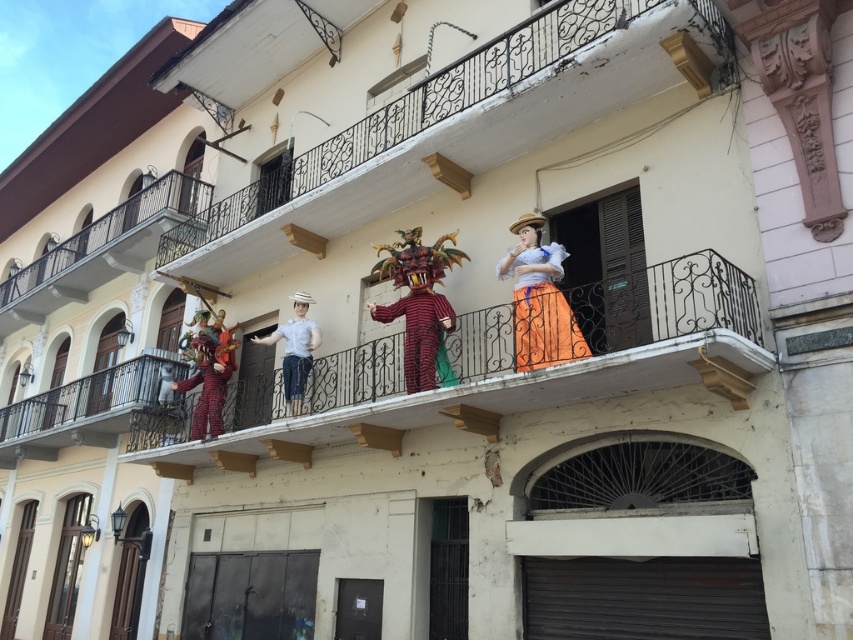
You are standing on the ground floor of the two story building and looking up at the white wrought iron balcony at upper left and the orange satin dress at center. Which object is higher up?

The white wrought iron balcony at upper left is located above the orange satin dress at center, so it is higher up.

You are an architect assessing the building structure. The white wrought iron balcony at upper left and the orange satin dress at center are both visible from the street. Which object would cast a larger shadow during midday when the sun is directly overhead?

The white wrought iron balcony at upper left is bigger than the orange satin dress at center, so it would cast a larger shadow during midday when the sun is directly overhead.

You are standing in front of the two story building and want to determine which of the two points, point (219,225) or point (140,262), is closer to you. Which one is closer?

Point (219,225) is closer to the camera than point (140,262).